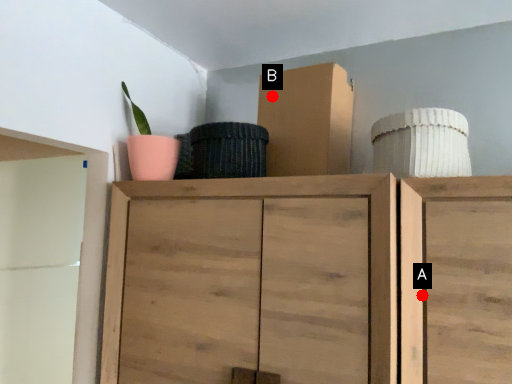
Question: Two points are circled on the image, labeled by A and B beside each circle. Which point is farther from the camera taking this photo?

Choices:
 (A) A is further
 (B) B is further

Answer: (B)